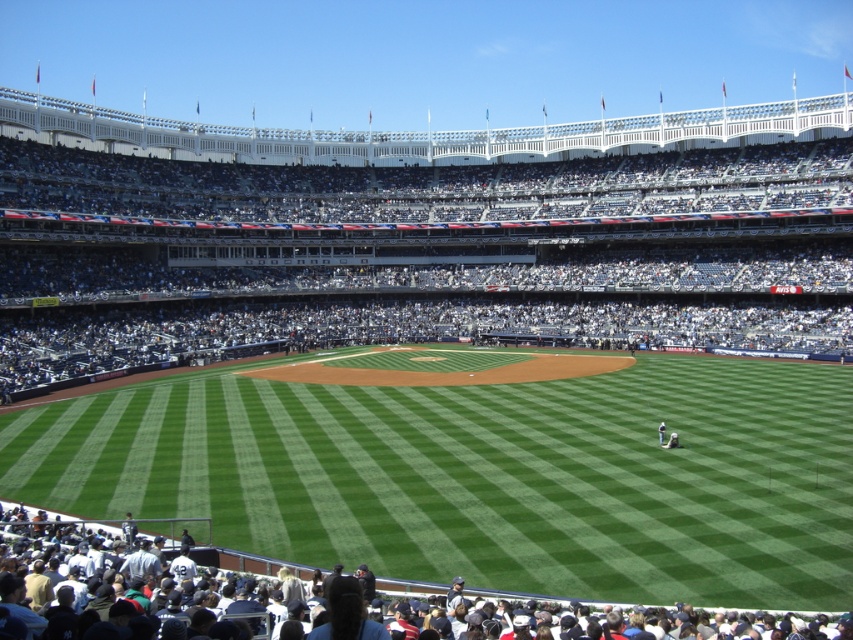
Who is lower down, green grass at center or white cotton shirt at lower center?

white cotton shirt at lower center is below.

Can you confirm if green grass at center is positioned below white cotton shirt at lower center?

Actually, green grass at center is above white cotton shirt at lower center.

The image size is (853, 640). What are the coordinates of `green grass at center` in the screenshot? It's located at (485, 476).

I want to click on green grass at center, so click(x=485, y=476).